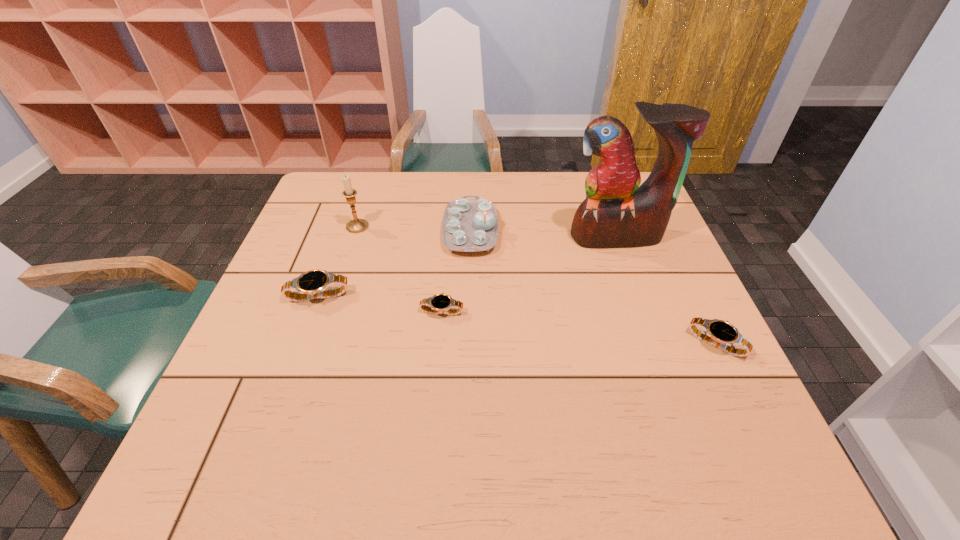
The width and height of the screenshot is (960, 540). I want to click on free space that satisfies the following two spatial constraints: 1. at the face of the parrot; 2. on the right side of the second tallest watch, so click(x=655, y=343).

The height and width of the screenshot is (540, 960). In order to click on free space in the image that satisfies the following two spatial constraints: 1. at the face of the nearest watch; 2. on the right side of the tallest object in this screenshot , I will do `click(655, 343)`.

Locate an element on the screen. free spot that satisfies the following two spatial constraints: 1. on the front side of the shortest watch; 2. on the left side of the second tallest object is located at coordinates (329, 311).